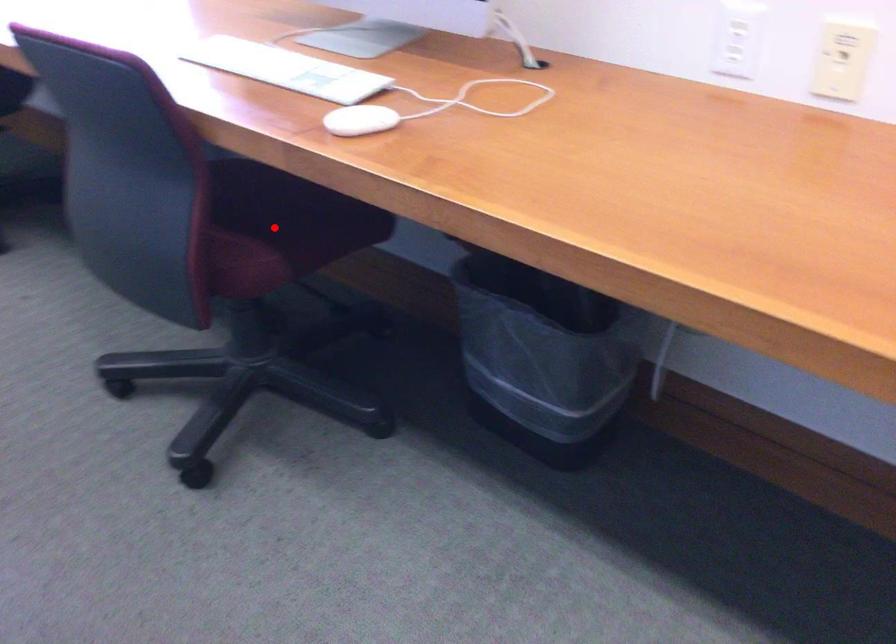
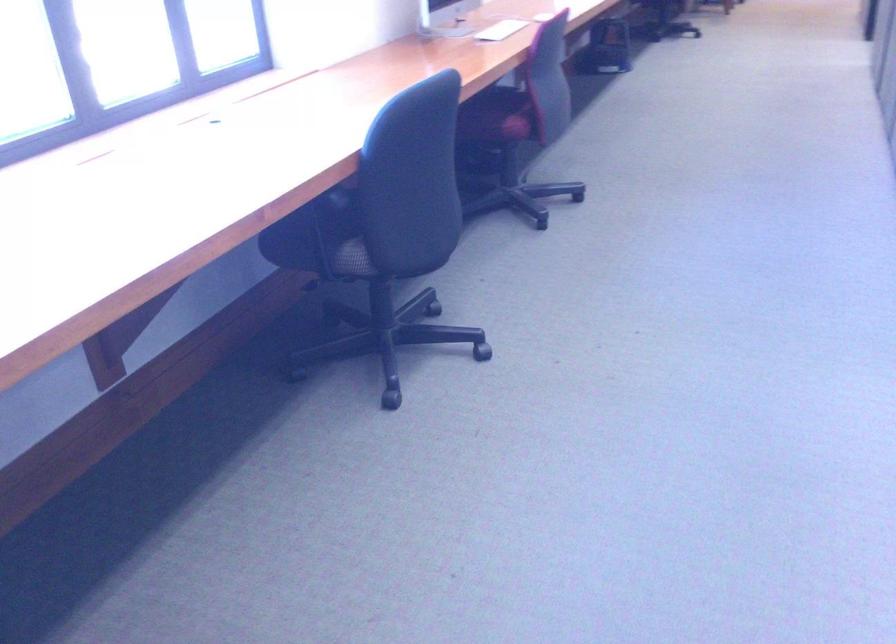
Question: I am providing you with two images of the same scene from different viewpoints. A red point is marked on the first image. Is the red point's position out of view in image 2?

Choices:
 (A) Yes
 (B) No

Answer: (A)